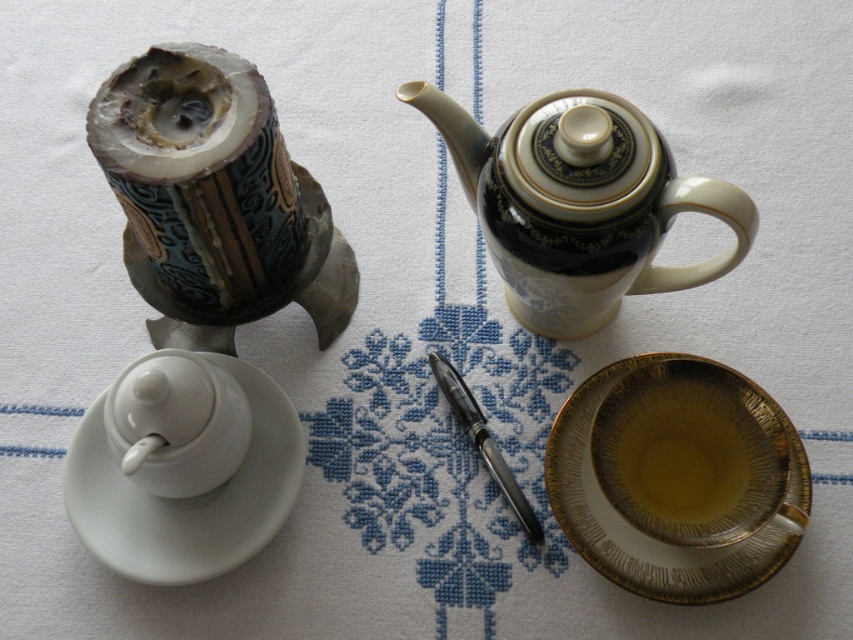
Between gold textured saucer at lower right and white ceramic saucer at lower left, which one is positioned lower?

Positioned lower is gold textured saucer at lower right.

Does gold textured saucer at lower right have a larger size compared to white ceramic saucer at lower left?

No.

Which is behind, point (585, 438) or point (209, 576)?

The point (585, 438) is behind.

Where is `gold textured saucer at lower right`? gold textured saucer at lower right is located at coordinates (677, 477).

Does white glossy teacup at lower left have a greater width compared to metallic pen at center?

Indeed, white glossy teacup at lower left has a greater width compared to metallic pen at center.

Does white glossy teacup at lower left have a smaller size compared to metallic pen at center?

Actually, white glossy teacup at lower left might be larger than metallic pen at center.

Locate an element on the screen. white glossy teacup at lower left is located at coordinates (177, 422).

Locate an element on the screen. This screenshot has height=640, width=853. white glossy teacup at lower left is located at coordinates (177, 422).

Does gold textured saucer at lower right have a smaller size compared to black porcelain teapot at upper right?

Correct, gold textured saucer at lower right occupies less space than black porcelain teapot at upper right.

Who is higher up, gold textured saucer at lower right or black porcelain teapot at upper right?

black porcelain teapot at upper right is above.

Measure the distance between gold textured saucer at lower right and camera.

gold textured saucer at lower right and camera are 3.44 feet apart from each other.

Locate an element on the screen. gold textured saucer at lower right is located at coordinates (677, 477).